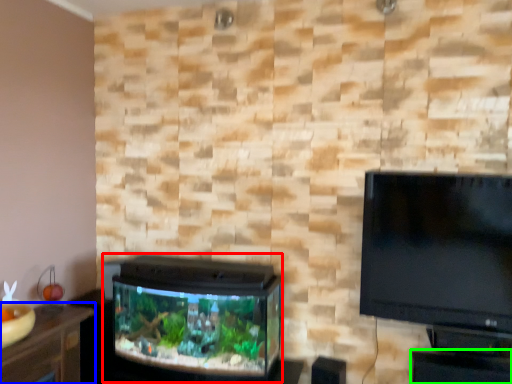
Question: Based on their relative distances, which object is nearer to tv cabinet (highlighted by a red box)? Choose from furniture (highlighted by a blue box) and table (highlighted by a green box).

Choices:
 (A) furniture
 (B) table

Answer: (A)